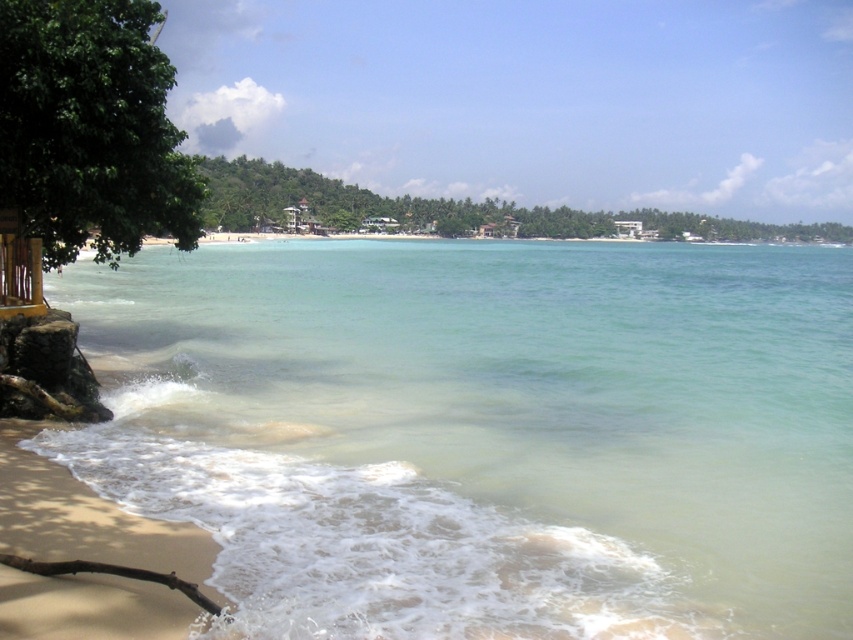
Is point (534, 515) farther from camera compared to point (791, 237)?

No, (534, 515) is in front of (791, 237).

Is point (309, 440) farther from camera compared to point (311, 205)?

No, it is not.

This screenshot has height=640, width=853. What are the coordinates of `clear water at lower left` in the screenshot? It's located at (486, 433).

Is the position of green leafy tree at left more distant than that of green leafy tree at upper center?

No, green leafy tree at left is closer to the viewer.

Between point (36, 228) and point (515, 205), which one is positioned behind?

The point (515, 205) is more distant.

Image resolution: width=853 pixels, height=640 pixels. What do you see at coordinates (90, 129) in the screenshot? I see `green leafy tree at left` at bounding box center [90, 129].

This screenshot has height=640, width=853. What are the coordinates of `green leafy tree at left` in the screenshot? It's located at (90, 129).

Which is in front, point (15, 192) or point (68, 612)?

Positioned in front is point (68, 612).

Does point (70, 93) lie in front of point (1, 458)?

No, it is not.

Between point (146, 51) and point (20, 579), which one is positioned behind?

The point (146, 51) is behind.

Identify the location of green leafy tree at left. [x=90, y=129].